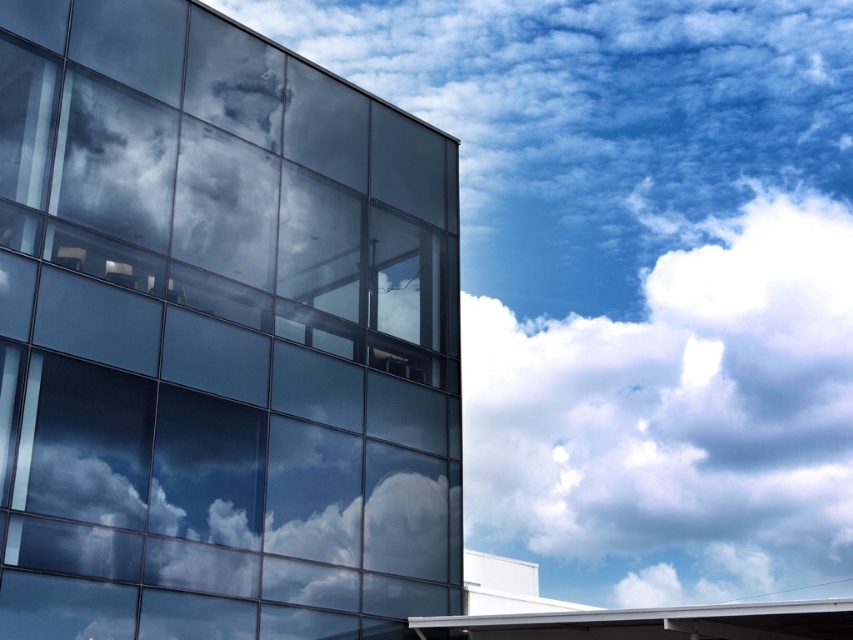
Question: Which object appears closest to the camera in this image?

Choices:
 (A) transparent glass window at left
 (B) white fluffy cloud at upper right

Answer: (A)

Question: Can you confirm if transparent glass window at left is wider than white fluffy cloud at upper right?

Choices:
 (A) yes
 (B) no

Answer: (B)

Question: Does transparent glass window at left have a lesser width compared to white fluffy cloud at upper right?

Choices:
 (A) no
 (B) yes

Answer: (B)

Question: Can you confirm if transparent glass window at left is positioned below white fluffy cloud at upper right?

Choices:
 (A) no
 (B) yes

Answer: (A)